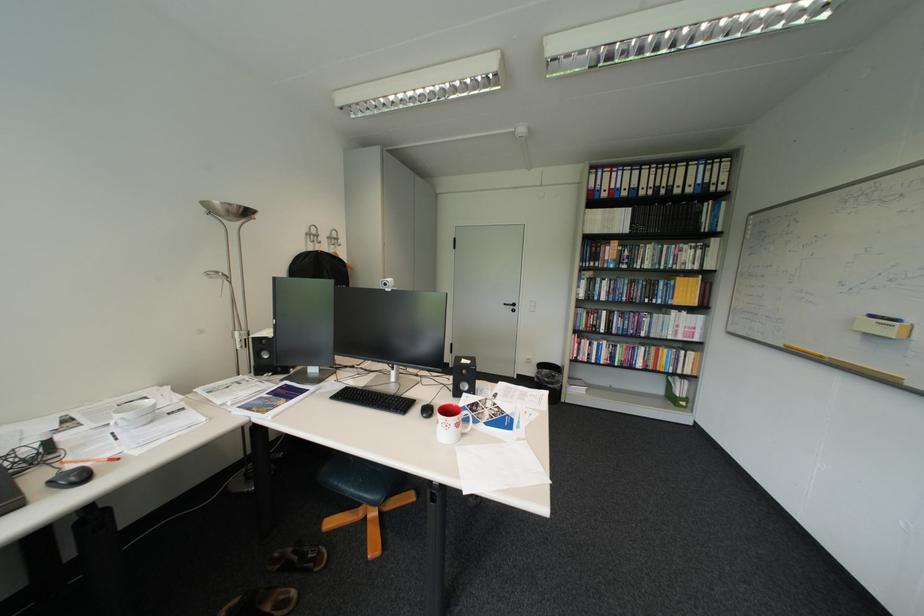
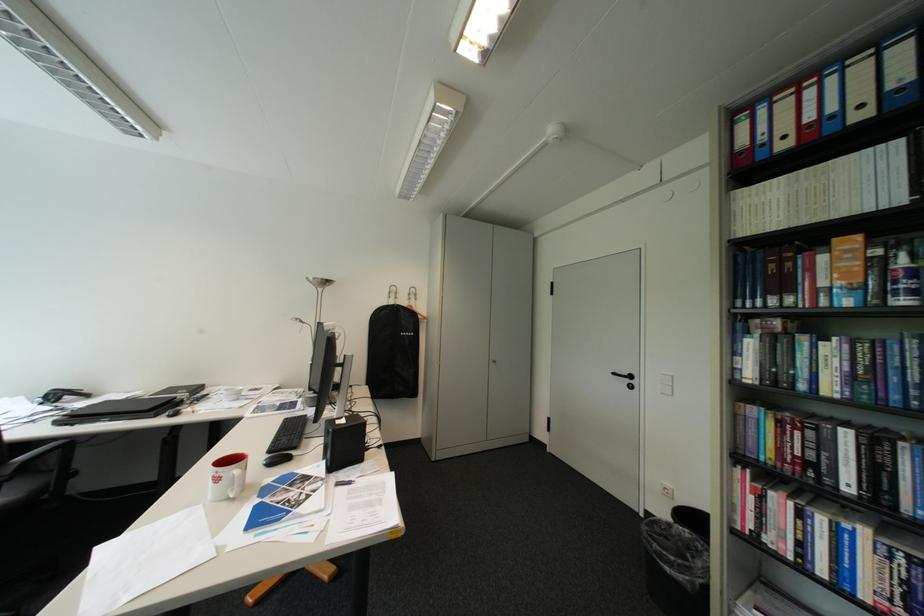
In the second image, find the point that corresponds to pixel 636 261 in the first image.

(907, 284)